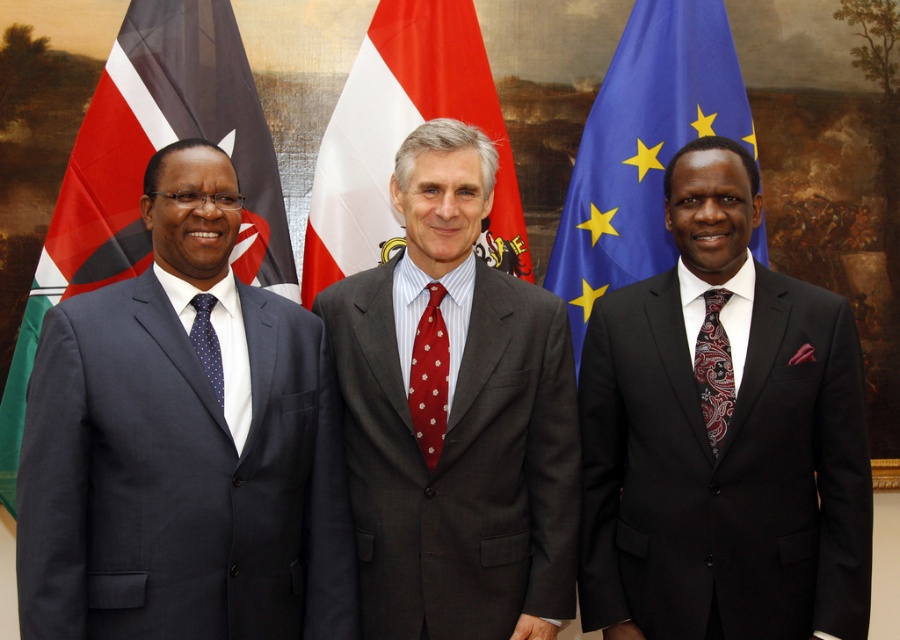
You are a photographer taking a picture of the three men. You need to adjust your camera to focus on the white fabric flag at center and the red dotted fabric tie at center. Which one should you focus on first if you want to ensure both are in focus?

The white fabric flag at center is above the red dotted fabric tie at center. Since the flag is higher up, you should focus on the white fabric flag at center first to ensure both are in focus.

You are a photographer adjusting the camera to capture a detailed shot of both the blue fabric flag at right and the paisley silk tie at right. The minimum distance between these two objects must be at least 70 centimeters to avoid blurring. Can you confirm if the current spacing allows for a clear photo?

The blue fabric flag at right and the paisley silk tie at right are 71.59 centimeters apart, which is more than the required 70 centimeters. Therefore, the current spacing allows for a clear photo without blurring.

You are a photographer who needs to capture a closeup of the red flag at left and the paisley silk tie at right. Given that your camera can only focus on objects within a 1.5 meter width, will both objects fit within the frame?

The red flag at left is wider than the paisley silk tie at right. Since the total width of both objects combined may exceed 1.5 meters, it is possible that they might not both fit within the camera frame. However, without knowing their exact distances from the camera, it is difficult to determine definitively.